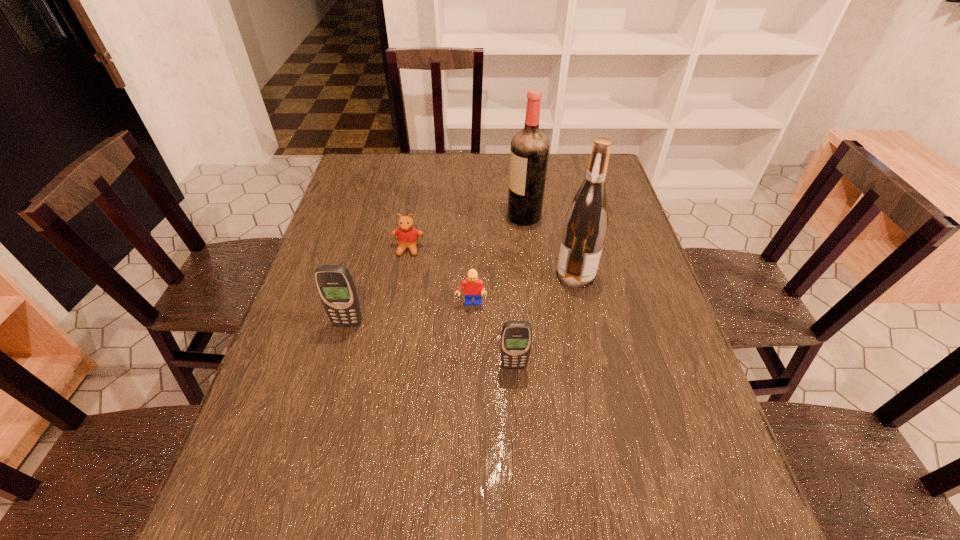
Please point a vacant point for placing a cellular telephone on the right. Please provide its 2D coordinates. Your answer should be formatted as a tuple, i.e. [(x, y)], where the tuple contains the x and y coordinates of a point satisfying the conditions above.

[(711, 417)]